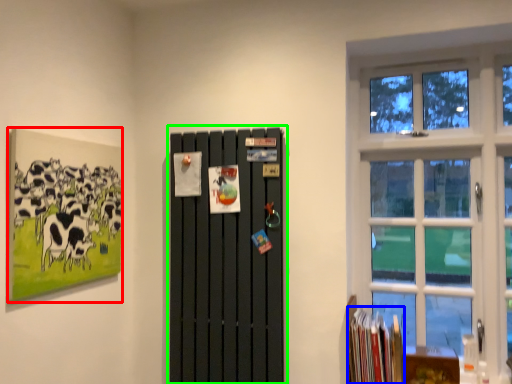
Question: Based on their relative distances, which object is nearer to picture frame (highlighted by a red box)? Choose from book (highlighted by a blue box) and barn door (highlighted by a green box).

Choices:
 (A) book
 (B) barn door

Answer: (B)